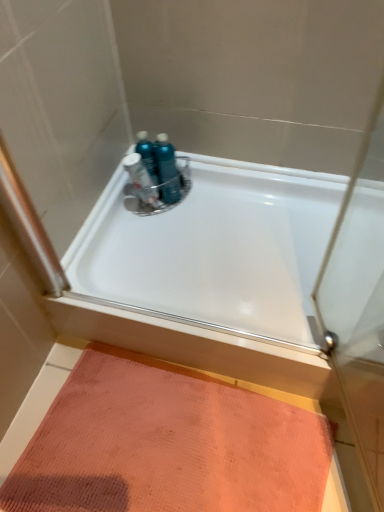
Question: Is point (175, 196) positioned closer to the camera than point (99, 208)?

Choices:
 (A) closer
 (B) farther

Answer: (B)

Question: Considering their positions, is teal plastic bottles at center, positioned as the first toiletry in right-to-left order, located in front of or behind white glossy bathtub at center?

Choices:
 (A) front
 (B) behind

Answer: (B)

Question: Which object is positioned closest to the orange textured mat at lower left?

Choices:
 (A) white glossy bathtub at center
 (B) teal plastic bottles at center, the third toiletry viewed from the left
 (C) blue glossy bottles at upper center, which is counted as the second toiletry, starting from the left
 (D) translucent plastic bottles at center, which is the first toiletry from left to right

Answer: (A)

Question: Which object is the farthest from the teal plastic bottles at center, positioned as the first toiletry in right-to-left order?

Choices:
 (A) orange textured mat at lower left
 (B) white glossy bathtub at center
 (C) translucent plastic bottles at center, positioned as the third toiletry in right-to-left order
 (D) blue glossy bottles at upper center, the second toiletry positioned from the right

Answer: (A)